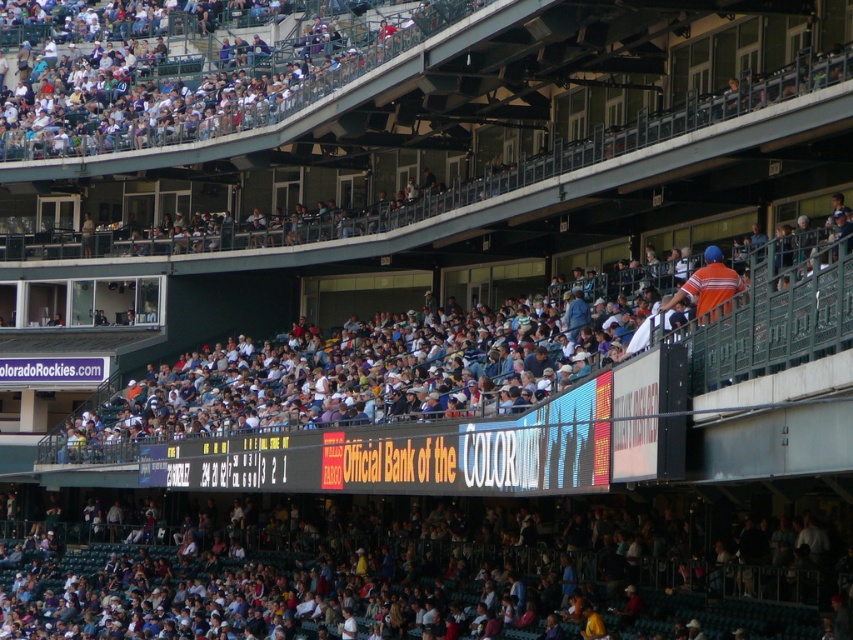
Who is lower down, dark blue seats at lower center or white plastic seats at upper center?

dark blue seats at lower center

Does dark blue seats at lower center have a lesser width compared to white plastic seats at upper center?

No.

Is point (62, 611) positioned in front of point (277, 108)?

Yes.

This screenshot has width=853, height=640. I want to click on dark blue seats at lower center, so click(x=398, y=586).